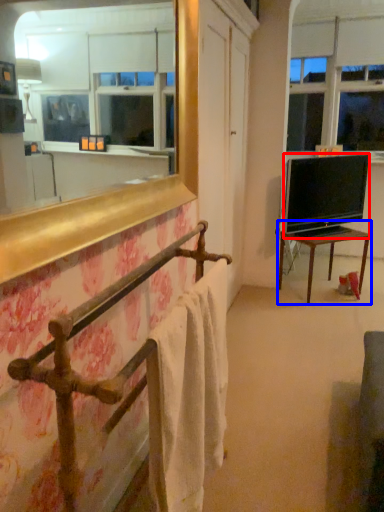
Question: Which point is further to the camera, television (highlighted by a red box) or table (highlighted by a blue box)?

Choices:
 (A) television
 (B) table

Answer: (B)